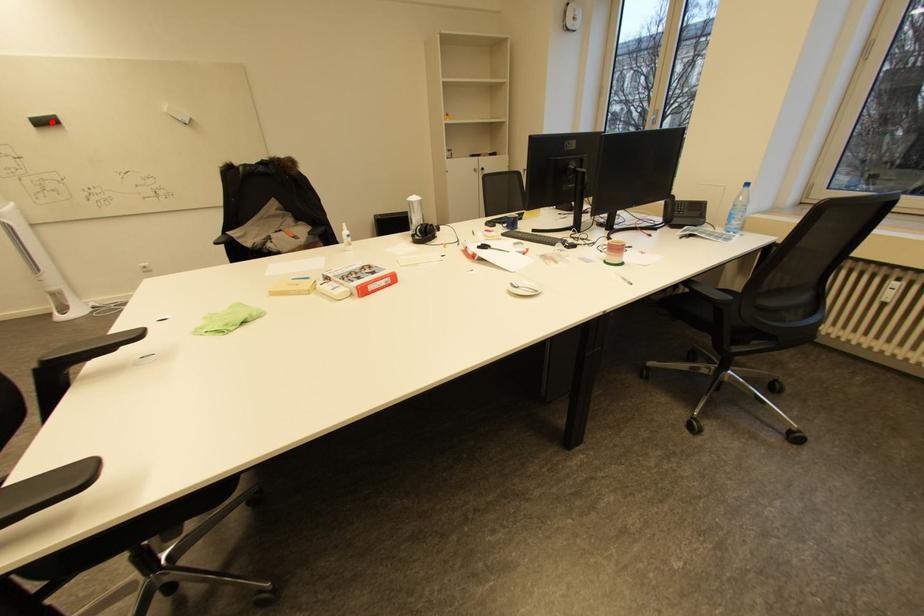
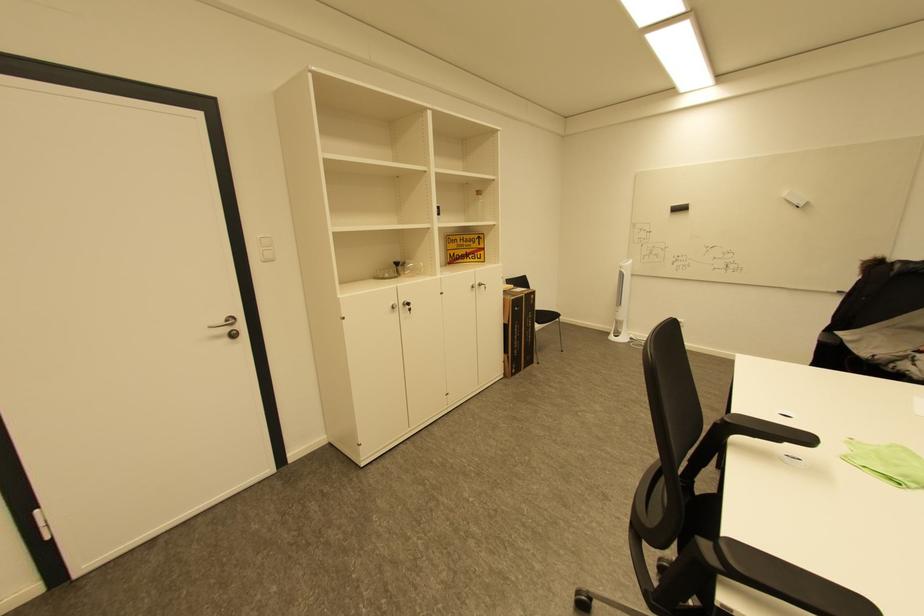
Question: I am providing you with two images of the same scene from different viewpoints. Given a red point in image1, look at the same physical point in image2. Is it:

Choices:
 (A) Closer to the viewpoint
 (B) Farther from the viewpoint

Answer: (A)